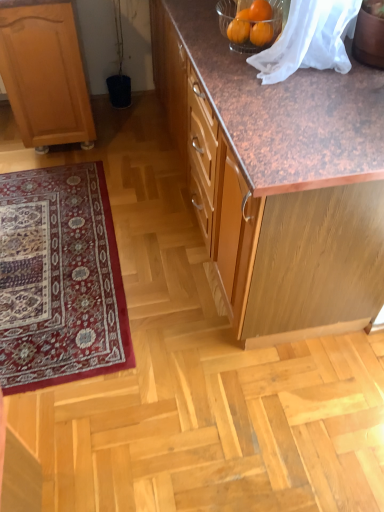
Question: From a real-world perspective, is carpeted rug at lower left on top of brown wood cabinet at center, which is counted as the 2th cabinetry, starting from the left?

Choices:
 (A) yes
 (B) no

Answer: (B)

Question: Considering the relative sizes of carpeted rug at lower left and brown wood cabinet at center, which is counted as the 2th cabinetry, starting from the left, in the image provided, is carpeted rug at lower left wider than brown wood cabinet at center, which is counted as the 2th cabinetry, starting from the left,?

Choices:
 (A) yes
 (B) no

Answer: (A)

Question: Does carpeted rug at lower left lie behind brown wood cabinet at center, which is counted as the 2th cabinetry, starting from the left?

Choices:
 (A) yes
 (B) no

Answer: (A)

Question: From the image's perspective, is carpeted rug at lower left located beneath brown wood cabinet at center, which is counted as the 2th cabinetry, starting from the left?

Choices:
 (A) no
 (B) yes

Answer: (B)

Question: Are carpeted rug at lower left and brown wood cabinet at center, the 1th cabinetry positioned from the right, located far from each other?

Choices:
 (A) no
 (B) yes

Answer: (A)

Question: Considering the positions of light brown wood cabinet at left, the second cabinetry positioned from the right, and brown wood cabinet at center, which is counted as the 2th cabinetry, starting from the left, in the image, is light brown wood cabinet at left, the second cabinetry positioned from the right, taller or shorter than brown wood cabinet at center, which is counted as the 2th cabinetry, starting from the left,?

Choices:
 (A) tall
 (B) short

Answer: (B)

Question: Does point (69, 129) appear closer or farther from the camera than point (226, 224)?

Choices:
 (A) closer
 (B) farther

Answer: (B)

Question: Is light brown wood cabinet at left, the 1th cabinetry from the left, spatially inside brown wood cabinet at center, which is counted as the 2th cabinetry, starting from the left, or outside of it?

Choices:
 (A) inside
 (B) outside

Answer: (B)

Question: Considering the positions of light brown wood cabinet at left, the 1th cabinetry from the left, and brown wood cabinet at center, the 1th cabinetry positioned from the right, in the image, is light brown wood cabinet at left, the 1th cabinetry from the left, bigger or smaller than brown wood cabinet at center, the 1th cabinetry positioned from the right,?

Choices:
 (A) big
 (B) small

Answer: (B)

Question: Is light brown wood cabinet at left, the second cabinetry positioned from the right, inside the boundaries of carpeted rug at lower left, or outside?

Choices:
 (A) inside
 (B) outside

Answer: (B)

Question: Considering their positions, is light brown wood cabinet at left, the 1th cabinetry from the left, located in front of or behind carpeted rug at lower left?

Choices:
 (A) front
 (B) behind

Answer: (B)

Question: Considering the positions of light brown wood cabinet at left, the 1th cabinetry from the left, and carpeted rug at lower left in the image, is light brown wood cabinet at left, the 1th cabinetry from the left, wider or thinner than carpeted rug at lower left?

Choices:
 (A) wide
 (B) thin

Answer: (B)

Question: Based on their sizes in the image, would you say light brown wood cabinet at left, the second cabinetry positioned from the right, is bigger or smaller than carpeted rug at lower left?

Choices:
 (A) big
 (B) small

Answer: (A)

Question: In the image, is carpeted rug at lower left positioned in front of or behind brown wood cabinet at center, which is counted as the 2th cabinetry, starting from the left?

Choices:
 (A) front
 (B) behind

Answer: (B)

Question: Considering the positions of carpeted rug at lower left and brown wood cabinet at center, which is counted as the 2th cabinetry, starting from the left, in the image, is carpeted rug at lower left taller or shorter than brown wood cabinet at center, which is counted as the 2th cabinetry, starting from the left,?

Choices:
 (A) short
 (B) tall

Answer: (A)